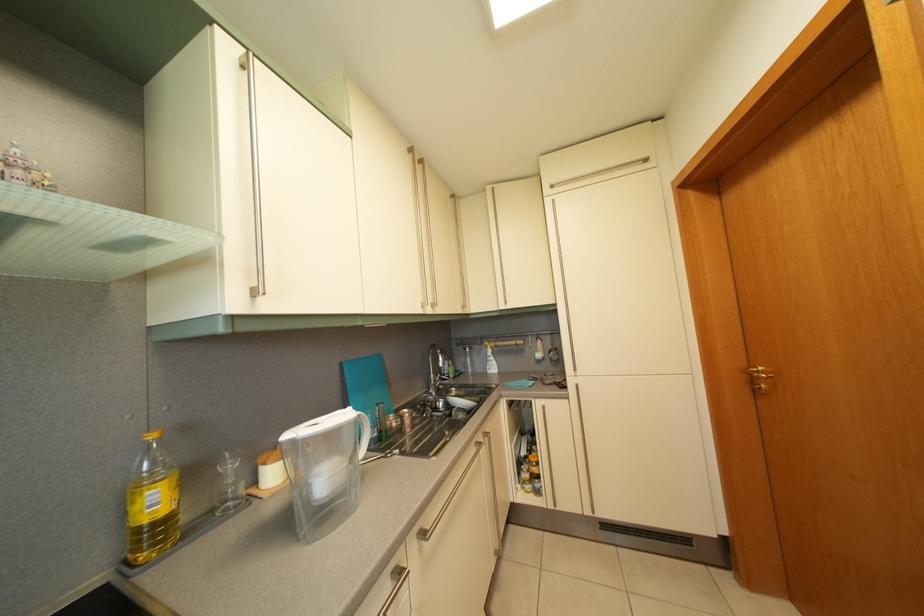
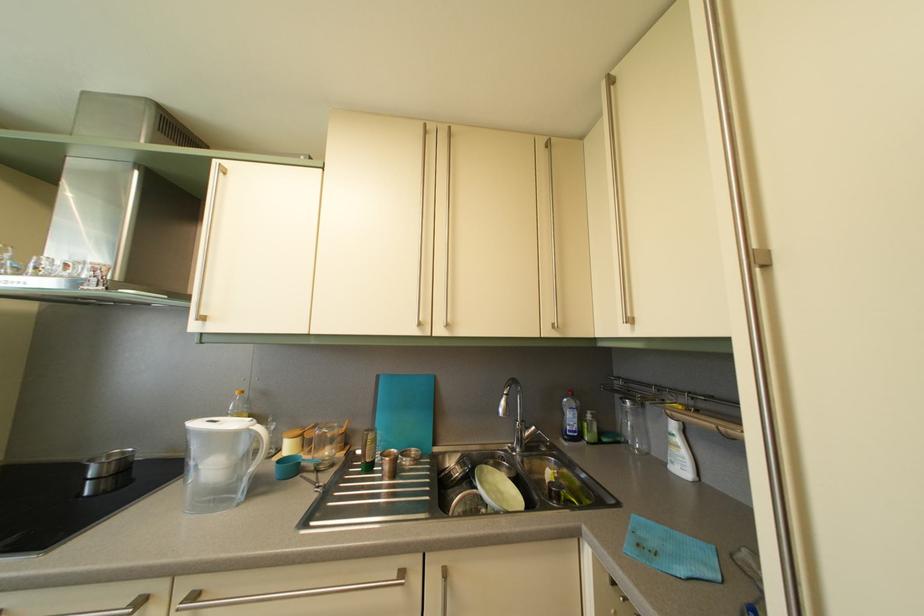
In the second image, find the point that corresponds to (438,318) in the first image.

(447, 339)